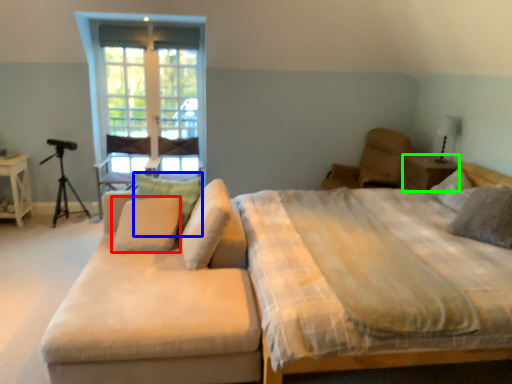
Question: Which is farther away from pillow (highlighted by a red box)? pillow (highlighted by a blue box) or nightstand (highlighted by a green box)?

Choices:
 (A) pillow
 (B) nightstand

Answer: (B)